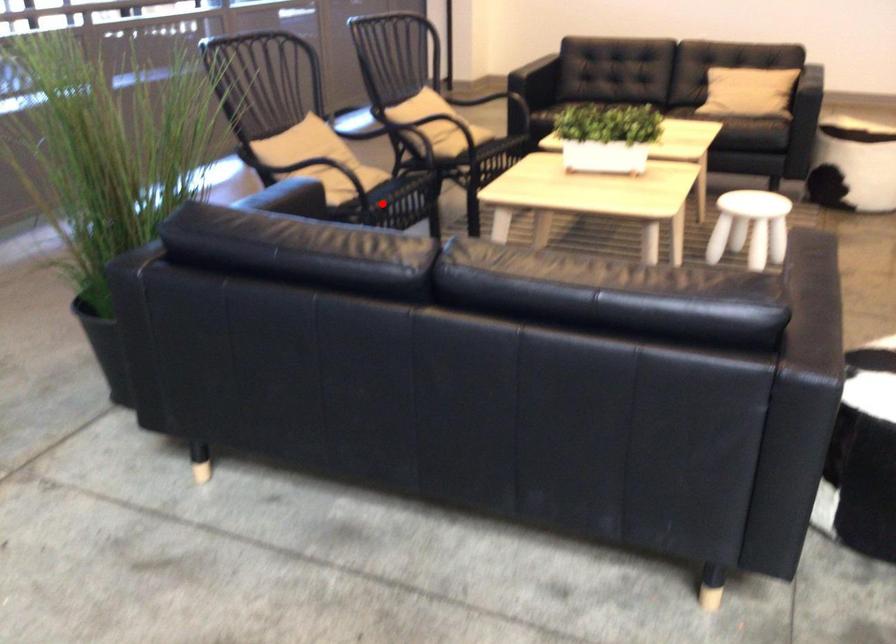
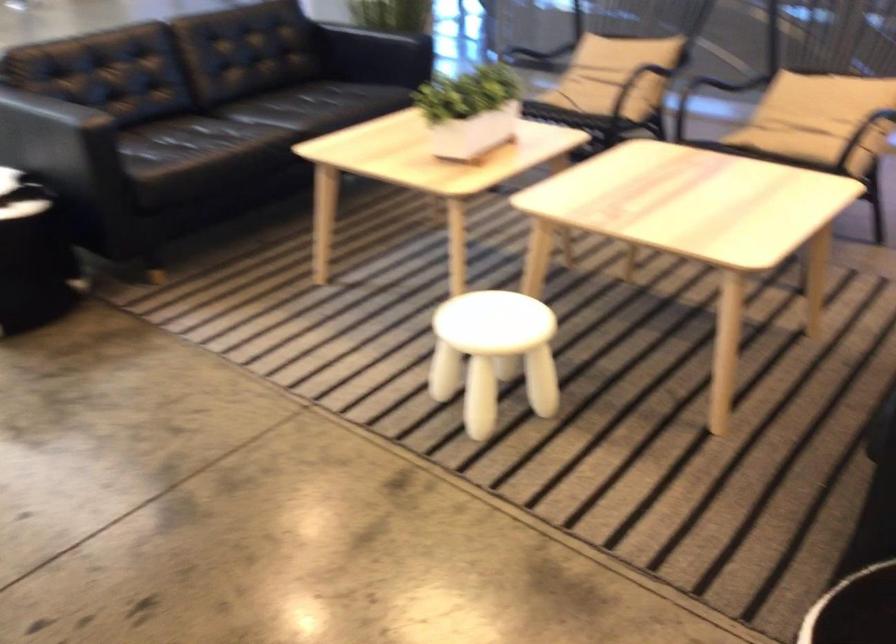
Question: I am providing you with two images of the same scene from different viewpoints. A red point is marked on the first image. At the location where the point appears in image 1, is it still visible in image 2?

Choices:
 (A) Yes
 (B) No

Answer: (B)